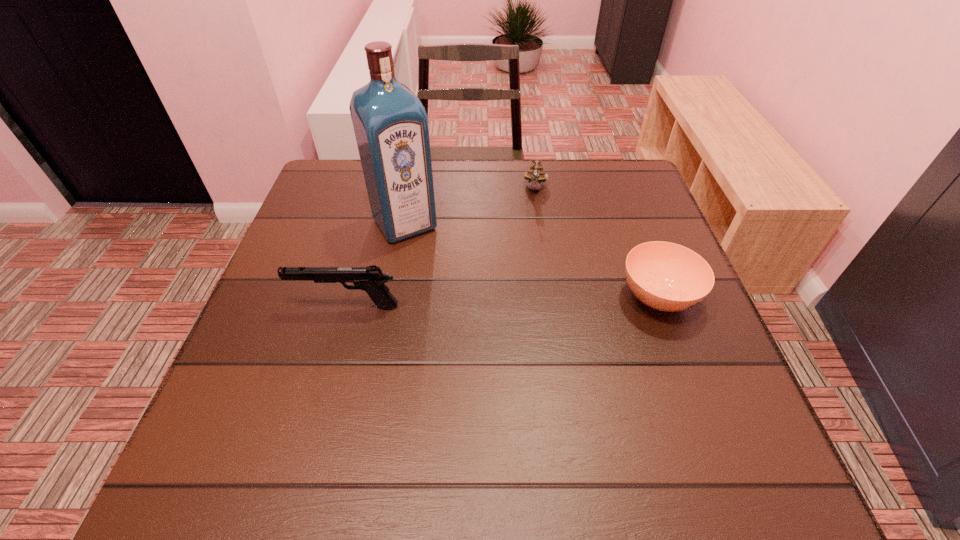
Locate an element on the screen. The height and width of the screenshot is (540, 960). vacant space located 0.130m on the face of the snail is located at coordinates (531, 234).

The height and width of the screenshot is (540, 960). What are the coordinates of `vacant space located on the face of the snail` in the screenshot? It's located at (533, 221).

Locate an element on the screen. free point located 0.300m on the flat label side of the tallest object is located at coordinates (478, 332).

This screenshot has height=540, width=960. Find the location of `free space located 0.050m on the flat label side of the tallest object`. free space located 0.050m on the flat label side of the tallest object is located at coordinates (426, 255).

At what (x,y) coordinates should I click in order to perform the action: click on free space located 0.230m on the flat label side of the tallest object. Please return your answer as a coordinate pair (x, y). This screenshot has height=540, width=960. Looking at the image, I should click on (462, 308).

Locate an element on the screen. The width and height of the screenshot is (960, 540). snail situated at the far edge is located at coordinates (535, 175).

The image size is (960, 540). Find the location of `liquor situated at the far edge`. liquor situated at the far edge is located at coordinates (390, 123).

The image size is (960, 540). I want to click on object positioned at the left edge, so click(371, 279).

Where is `object at the right edge`? The width and height of the screenshot is (960, 540). object at the right edge is located at coordinates (665, 276).

In the image, there is a desktop. Identify the location of vacant space at the far edge. The width and height of the screenshot is (960, 540). (485, 189).